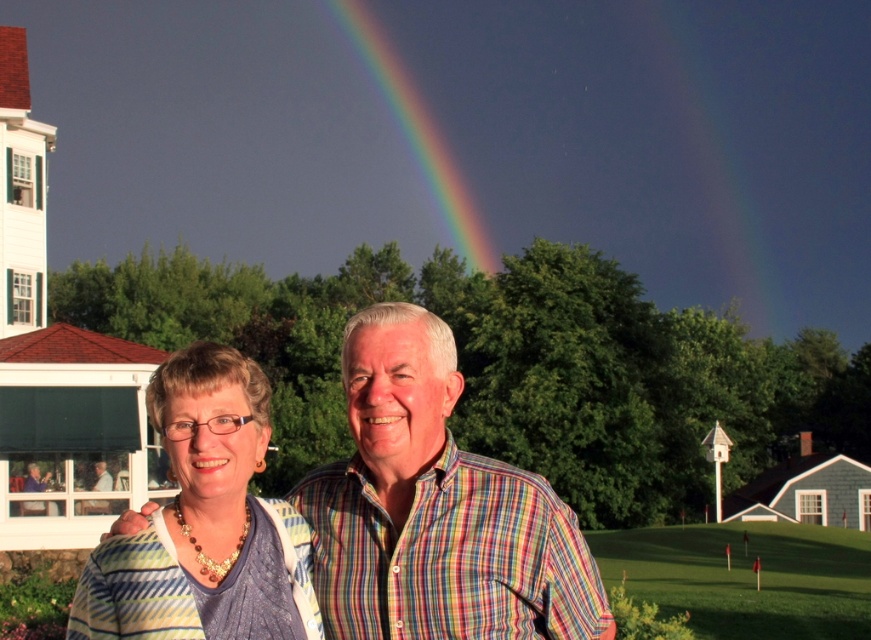
Does striped fabric shirt at center appear on the right side of green grass at lower right?

In fact, striped fabric shirt at center is to the left of green grass at lower right.

Can you confirm if striped fabric shirt at center is smaller than green grass at lower right?

Correct, striped fabric shirt at center occupies less space than green grass at lower right.

Measure the distance between point [219,618] and camera.

They are 13.37 meters apart.

You are a GUI agent. You are given a task and a screenshot of the screen. Output one action in this format:
    pyautogui.click(x=<x>, y=<y>)
    Task: Click on the striped fabric shirt at center
    The width and height of the screenshot is (871, 640).
    Given the screenshot: What is the action you would take?
    pyautogui.click(x=206, y=522)

Who is more forward, (x=368, y=35) or (x=99, y=474)?

Point (x=99, y=474) is in front.

Which is below, rainbow at upper center or matte black shirt at center?

matte black shirt at center is below.

The width and height of the screenshot is (871, 640). Identify the location of rainbow at upper center. (419, 131).

Find the location of `rainbow at upper center`. rainbow at upper center is located at coordinates (419, 131).

Which is below, striped cotton shirt at center or matte black shirt at center?

Positioned lower is matte black shirt at center.

Which is more to the left, striped cotton shirt at center or matte black shirt at center?

matte black shirt at center

Where is `striped cotton shirt at center`? striped cotton shirt at center is located at coordinates (436, 509).